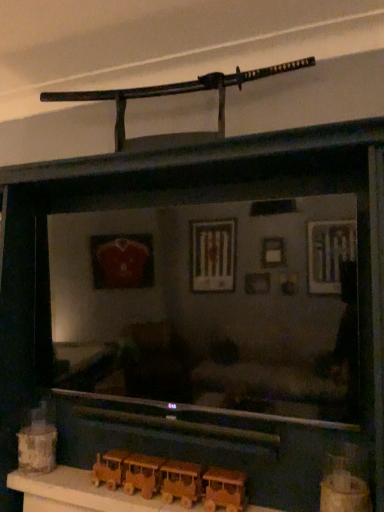
What do you see at coordinates (342, 488) in the screenshot? The width and height of the screenshot is (384, 512). I see `wooden train at lower center, the first toy when ordered from right to left` at bounding box center [342, 488].

Describe the element at coordinates (81, 494) in the screenshot. I see `wooden train set at lower center` at that location.

Identify the location of wooden train at lower center, the 2th toy from the left. The height and width of the screenshot is (512, 384). (171, 480).

Would you say wooden toy train at lower left, which is counted as the 3th toy, starting from the front, is outside wooden train at lower center, which is counted as the 2th toy, starting from the back?

wooden toy train at lower left, which is counted as the 3th toy, starting from the front, lies outside wooden train at lower center, which is counted as the 2th toy, starting from the back,'s area.

Which is further, (31, 415) or (189, 482)?

Positioned behind is point (31, 415).

From the image's perspective, which one is positioned higher, wooden toy train at lower left, which is counted as the 3th toy, starting from the front, or wooden train at lower center, which is the second toy in front-to-back order?

From the image's view, wooden toy train at lower left, which is counted as the 3th toy, starting from the front, is above.

Based on the photo, is wooden toy train at lower left, which is counted as the 3th toy, starting from the front, at the right side of wooden train at lower center, the 2th toy from the left?

Incorrect, wooden toy train at lower left, which is counted as the 3th toy, starting from the front, is not on the right side of wooden train at lower center, the 2th toy from the left.

Considering the sizes of wooden train at lower center, which is the second toy in front-to-back order, and wooden toy train at lower left, the first toy viewed from the left, in the image, is wooden train at lower center, which is the second toy in front-to-back order, wider or thinner than wooden toy train at lower left, the first toy viewed from the left,?

Clearly, wooden train at lower center, which is the second toy in front-to-back order, has less width compared to wooden toy train at lower left, the first toy viewed from the left.

Is wooden train at lower center, arranged as the second toy when viewed from the right, positioned with its back to wooden toy train at lower left, which ranks as the third toy in right-to-left order?

No, wooden train at lower center, arranged as the second toy when viewed from the right,'s orientation is not away from wooden toy train at lower left, which ranks as the third toy in right-to-left order.

From the image's perspective, relative to wooden toy train at lower left, the first toy viewed from the left, is wooden train at lower center, which is counted as the 2th toy, starting from the back, above or below?

wooden train at lower center, which is counted as the 2th toy, starting from the back, is situated lower than wooden toy train at lower left, the first toy viewed from the left, in the image.

From a real-world perspective, does wooden train at lower center, the first toy from the front, stand above wooden toy train at lower left, which ranks as the third toy in right-to-left order?

Actually, wooden train at lower center, the first toy from the front, is physically below wooden toy train at lower left, which ranks as the third toy in right-to-left order, in the real world.

Which toy is the 2nd one when counting from the front of the wooden toy train at lower left, the first toy viewed from the left? Please provide its 2D coordinates.

[(342, 488)]

Which of these two, wooden train at lower center, the third toy positioned from the back, or wooden toy train at lower left, the first toy viewed from the left, is wider?

wooden toy train at lower left, the first toy viewed from the left.

From the image's perspective, which object appears higher, wooden train at lower center, which appears as the 3th toy when viewed from the left, or wooden train at lower center, which is counted as the 2th toy, starting from the back?

From the image's view, wooden train at lower center, which appears as the 3th toy when viewed from the left, is above.

Is wooden train at lower center, the third toy positioned from the back, facing towards wooden train at lower center, which is the second toy in front-to-back order?

No, wooden train at lower center, the third toy positioned from the back, is not turned towards wooden train at lower center, which is the second toy in front-to-back order.

Is wooden train at lower center, the first toy from the front, not inside wooden train at lower center, which is the second toy in front-to-back order?

wooden train at lower center, the first toy from the front, is positioned outside wooden train at lower center, which is the second toy in front-to-back order.

From a real-world perspective, which object rests below the other?

wooden train set at lower center.

Are wooden train at lower center, the third toy positioned from the back, and wooden train set at lower center located far from each other?

wooden train at lower center, the third toy positioned from the back, is actually quite close to wooden train set at lower center.

From a real-world perspective, starting from the wooden train set at lower center, which toy is the 2nd one vertically above it? Please provide its 2D coordinates.

[(342, 488)]

How many degrees apart are the facing directions of wooden train set at lower center and wooden toy train at lower left, the first toy viewed from the left?

0.00335 degrees.

Is wooden train set at lower center not near wooden toy train at lower left, the first toy viewed from the left?

wooden train set at lower center is actually quite close to wooden toy train at lower left, the first toy viewed from the left.

Is wooden train set at lower center positioned in front of wooden toy train at lower left, which ranks as the third toy in right-to-left order?

Yes, wooden train set at lower center is closer to the viewer.

Considering the relative positions of wooden train set at lower center and wooden toy train at lower left, which is counted as the 3th toy, starting from the front, in the image provided, is wooden train set at lower center to the left or to the right of wooden toy train at lower left, which is counted as the 3th toy, starting from the front,?

In the image, wooden train set at lower center appears on the right side of wooden toy train at lower left, which is counted as the 3th toy, starting from the front.

Considering the relative positions of wooden toy train at lower left, the first toy positioned from the back, and wooden train at lower center, which appears as the 3th toy when viewed from the left, in the image provided, is wooden toy train at lower left, the first toy positioned from the back, behind wooden train at lower center, which appears as the 3th toy when viewed from the left,?

That is True.

From the image's perspective, who appears lower, wooden toy train at lower left, which is counted as the 3th toy, starting from the front, or wooden train at lower center, the third toy positioned from the back?

wooden toy train at lower left, which is counted as the 3th toy, starting from the front, from the image's perspective.

Considering the sizes of objects wooden toy train at lower left, the first toy viewed from the left, and wooden train at lower center, the first toy when ordered from right to left, in the image provided, who is smaller, wooden toy train at lower left, the first toy viewed from the left, or wooden train at lower center, the first toy when ordered from right to left,?

Smaller between the two is wooden toy train at lower left, the first toy viewed from the left.

How much distance is there between wooden toy train at lower left, the first toy positioned from the back, and wooden train at lower center, the first toy from the front?

They are 3.50 feet apart.

You are a GUI agent. You are given a task and a screenshot of the screen. Output one action in this format:
    pyautogui.click(x=<x>, y=<y>)
    Task: Click on the toy below the wooden toy train at lower left, the first toy positioned from the back (from the image's perspective)
    Image resolution: width=384 pixels, height=512 pixels.
    Given the screenshot: What is the action you would take?
    pyautogui.click(x=171, y=480)

At what (x,y) coordinates should I click in order to perform the action: click on the 2nd toy positioned below the wooden toy train at lower left, the first toy viewed from the left (from a real-world perspective). Please return your answer as a coordinate pair (x, y). Looking at the image, I should click on (171, 480).

Looking at the image, which one is located closer to wooden train set at lower center, wooden toy train at lower left, which is counted as the 3th toy, starting from the front, or wooden train at lower center, the 2th toy from the left?

wooden train at lower center, the 2th toy from the left, is positioned closer to the anchor wooden train set at lower center.

Considering their positions, is wooden toy train at lower left, which ranks as the third toy in right-to-left order, positioned further to wooden train at lower center, the first toy from the front, than wooden train at lower center, which is counted as the 2th toy, starting from the back?

wooden toy train at lower left, which ranks as the third toy in right-to-left order, is further to wooden train at lower center, the first toy from the front.

Estimate the real-world distances between objects in this image. Which object is closer to wooden train at lower center, the third toy positioned from the back, wooden toy train at lower left, which is counted as the 3th toy, starting from the front, or wooden train set at lower center?

wooden train set at lower center.

Considering their positions, is wooden train at lower center, the first toy when ordered from right to left, positioned closer to wooden toy train at lower left, the first toy viewed from the left, than wooden train at lower center, which is the second toy in front-to-back order?

wooden train at lower center, which is the second toy in front-to-back order, lies closer to wooden toy train at lower left, the first toy viewed from the left, than the other object.

Which object lies further to the anchor point wooden toy train at lower left, which ranks as the third toy in right-to-left order, wooden train set at lower center or wooden train at lower center, the first toy when ordered from right to left?

Among the two, wooden train at lower center, the first toy when ordered from right to left, is located further to wooden toy train at lower left, which ranks as the third toy in right-to-left order.

Estimate the real-world distances between objects in this image. Which object is closer to wooden train at lower center, which is the second toy in front-to-back order, wooden toy train at lower left, the first toy positioned from the back, or wooden train set at lower center?

Among the two, wooden train set at lower center is located nearer to wooden train at lower center, which is the second toy in front-to-back order.

In the scene shown: Considering their positions, is wooden train at lower center, which appears as the 3th toy when viewed from the left, positioned further to wooden toy train at lower left, the first toy positioned from the back, than wooden train set at lower center?

wooden train at lower center, which appears as the 3th toy when viewed from the left, lies further to wooden toy train at lower left, the first toy positioned from the back, than the other object.

When comparing their distances from wooden train at lower center, arranged as the second toy when viewed from the right, does wooden train set at lower center or wooden train at lower center, which appears as the 3th toy when viewed from the left, seem further?

wooden train at lower center, which appears as the 3th toy when viewed from the left, is positioned further to the anchor wooden train at lower center, arranged as the second toy when viewed from the right.

Where is `toy located between wooden train set at lower center and wooden train at lower center, the third toy positioned from the back, in the left-right direction`? toy located between wooden train set at lower center and wooden train at lower center, the third toy positioned from the back, in the left-right direction is located at coordinates (171, 480).

The height and width of the screenshot is (512, 384). What are the coordinates of `table between wooden toy train at lower left, which is counted as the 3th toy, starting from the front, and wooden train at lower center, the first toy when ordered from right to left, from left to right` in the screenshot? It's located at (81, 494).

In order to click on toy between wooden toy train at lower left, which is counted as the 3th toy, starting from the front, and wooden train at lower center, the first toy when ordered from right to left in this screenshot , I will do `click(171, 480)`.

At what (x,y) coordinates should I click in order to perform the action: click on table located between wooden toy train at lower left, which is counted as the 3th toy, starting from the front, and wooden train at lower center, which is the second toy in front-to-back order, in the left-right direction. Please return your answer as a coordinate pair (x, y). The image size is (384, 512). Looking at the image, I should click on (81, 494).